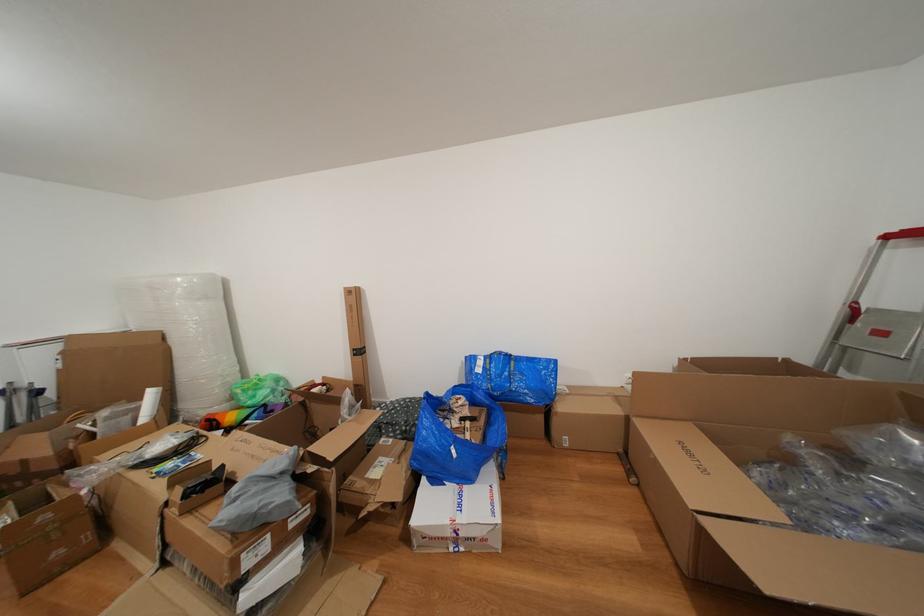
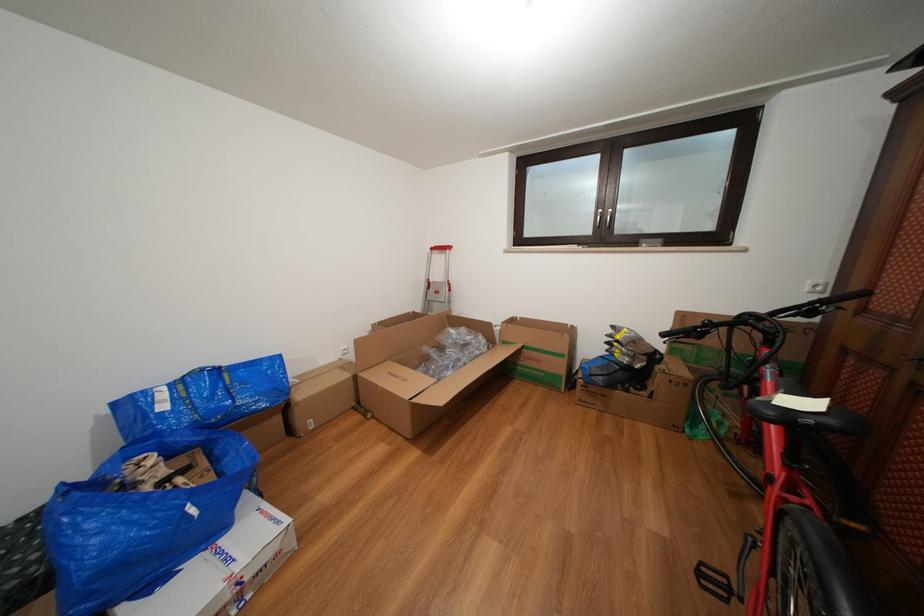
Where in the second image is the point corresponding to the point at 517,362 from the first image?

(225, 376)